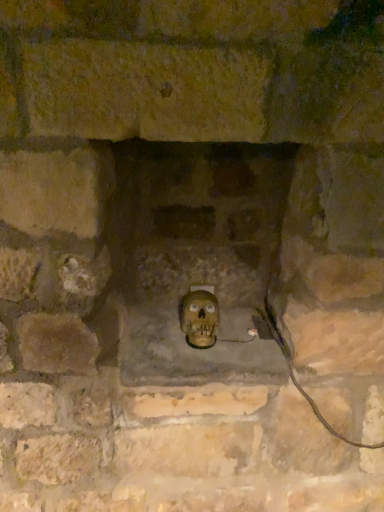
Where is `vacant area on the back side of matte brown skull at center`? The image size is (384, 512). vacant area on the back side of matte brown skull at center is located at coordinates (224, 317).